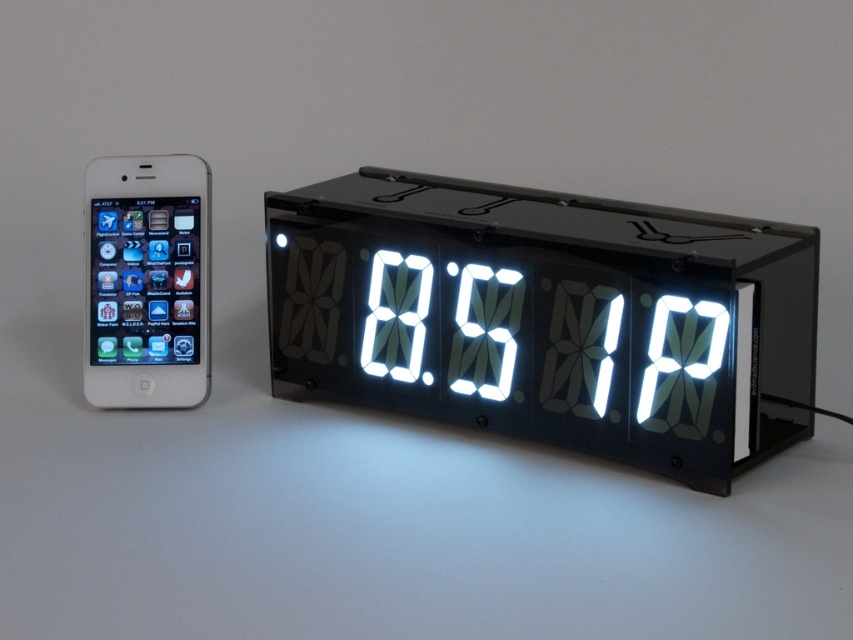
Question: Which point is farther to the camera?

Choices:
 (A) white led display at center
 (B) white glossy smartphone at left

Answer: (B)

Question: Can you confirm if white led display at center is positioned above white glossy smartphone at left?

Choices:
 (A) yes
 (B) no

Answer: (B)

Question: Which point is closer to the camera?

Choices:
 (A) white glossy smartphone at left
 (B) white led display at center

Answer: (B)

Question: Which point is closer to the camera?

Choices:
 (A) (593, 381)
 (B) (132, 282)

Answer: (A)

Question: Can you confirm if white led display at center is positioned to the left of white glossy smartphone at left?

Choices:
 (A) yes
 (B) no

Answer: (B)

Question: Is white led display at center further to camera compared to white glossy smartphone at left?

Choices:
 (A) yes
 (B) no

Answer: (B)